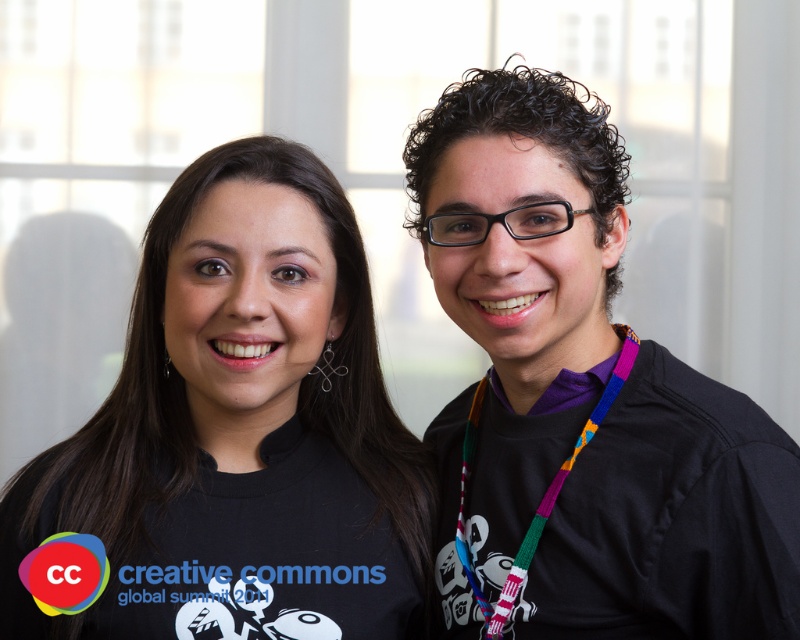
From the picture: You are organizing a photo exhibition and need to describe the spatial relationship between the black matte shirt at left and the purple fabric at center in the image. Which object is positioned lower in the frame?

The black matte shirt at left is positioned below the purple fabric at center, so it is lower in the frame.

You are organizing a photo exhibition and need to know the exact location of the black matte shirt at left in the image. What are its coordinates?

The black matte shirt at left is located at coordinates point (260, 444).